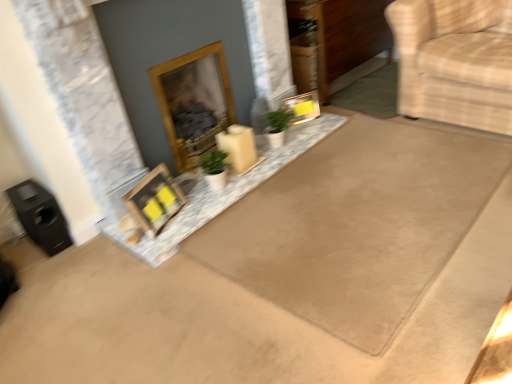
You are a GUI agent. You are given a task and a screenshot of the screen. Output one action in this format:
    pyautogui.click(x=<x>, y=<y>)
    Task: Click on the free space in front of matte gold picture frame at center, the 2th picture frame positioned from the front
    This screenshot has height=384, width=512.
    Given the screenshot: What is the action you would take?
    pyautogui.click(x=313, y=127)